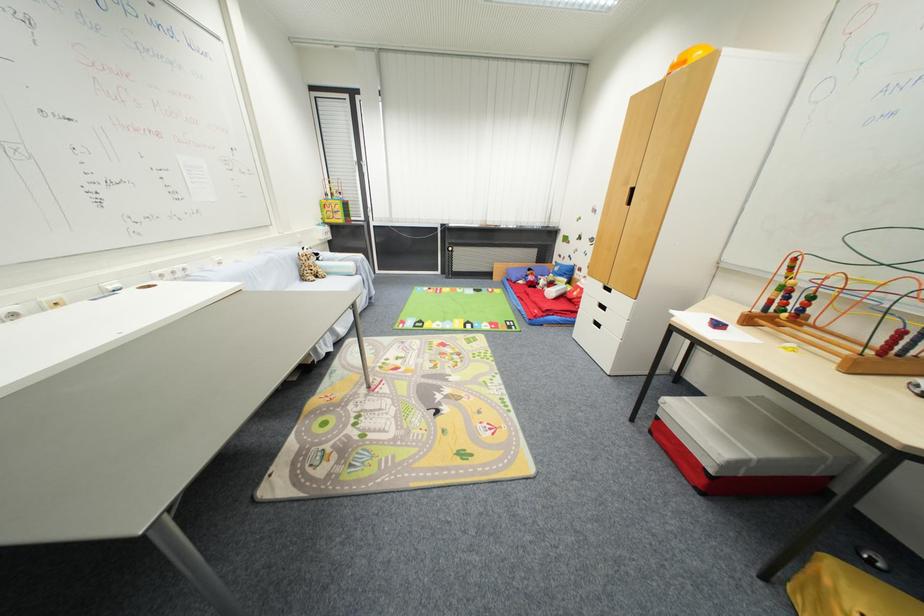
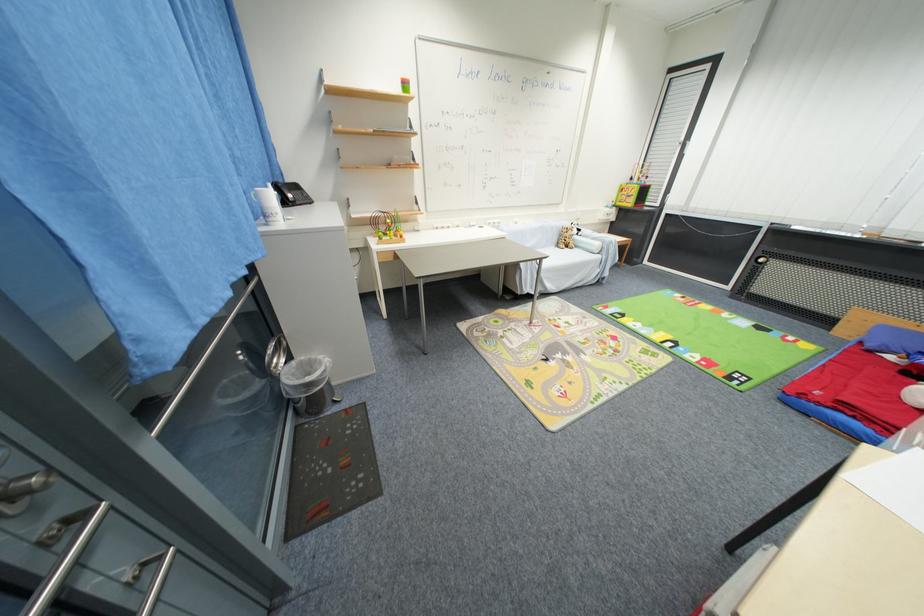
Locate, in the second image, the point that corresponds to (363,280) in the first image.

(603, 259)